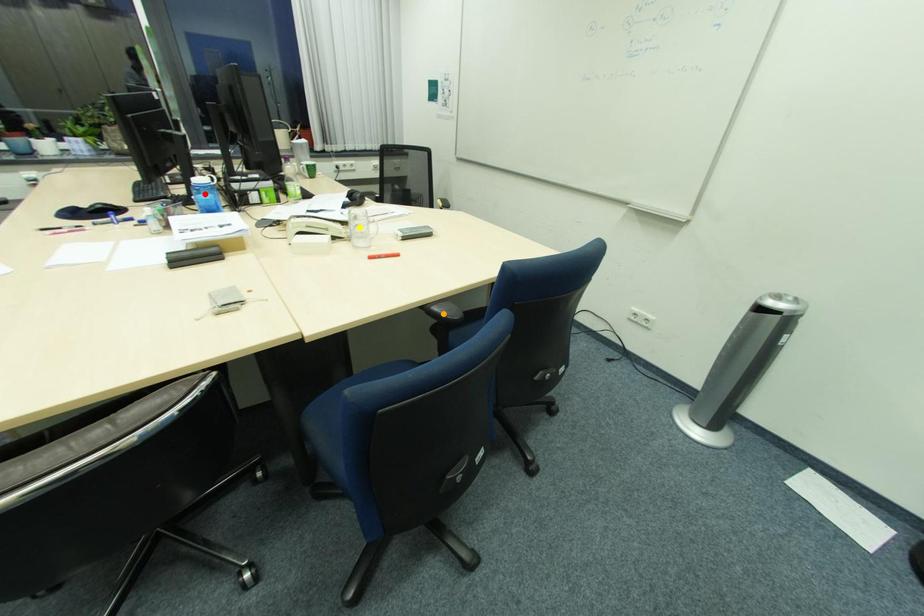
Order these from nearest to farthest:
A) yellow point
B) red point
C) orange point

orange point → yellow point → red point